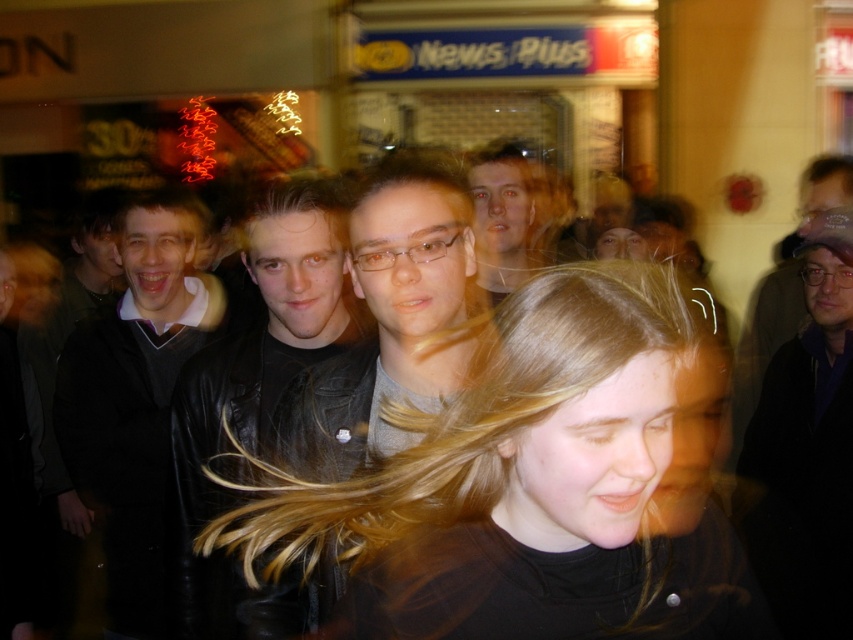
Can you confirm if leather jacket at center is positioned above blonde hair at left?

No.

Is leather jacket at center in front of blonde hair at left?

Yes.

Locate an element on the screen. leather jacket at center is located at coordinates pyautogui.click(x=392, y=317).

Where is `leather jacket at center`? Image resolution: width=853 pixels, height=640 pixels. leather jacket at center is located at coordinates (392, 317).

Consider the image. Is black leather jacket at center to the right of matte black jacket at center from the viewer's perspective?

No, black leather jacket at center is not to the right of matte black jacket at center.

Is black leather jacket at center taller than matte black jacket at center?

Indeed, black leather jacket at center has a greater height compared to matte black jacket at center.

Which is behind, point (180, 499) or point (549, 189)?

The point (549, 189) is behind.

You are a GUI agent. You are given a task and a screenshot of the screen. Output one action in this format:
    pyautogui.click(x=<x>, y=<y>)
    Task: Click on the black leather jacket at center
    The width and height of the screenshot is (853, 640).
    Given the screenshot: What is the action you would take?
    pyautogui.click(x=254, y=401)

Does dark gray sweater at left have a larger size compared to dark blue leather jacket at right?

Yes.

You are a GUI agent. You are given a task and a screenshot of the screen. Output one action in this format:
    pyautogui.click(x=<x>, y=<y>)
    Task: Click on the dark gray sweater at left
    The height and width of the screenshot is (640, 853).
    Given the screenshot: What is the action you would take?
    pyautogui.click(x=135, y=394)